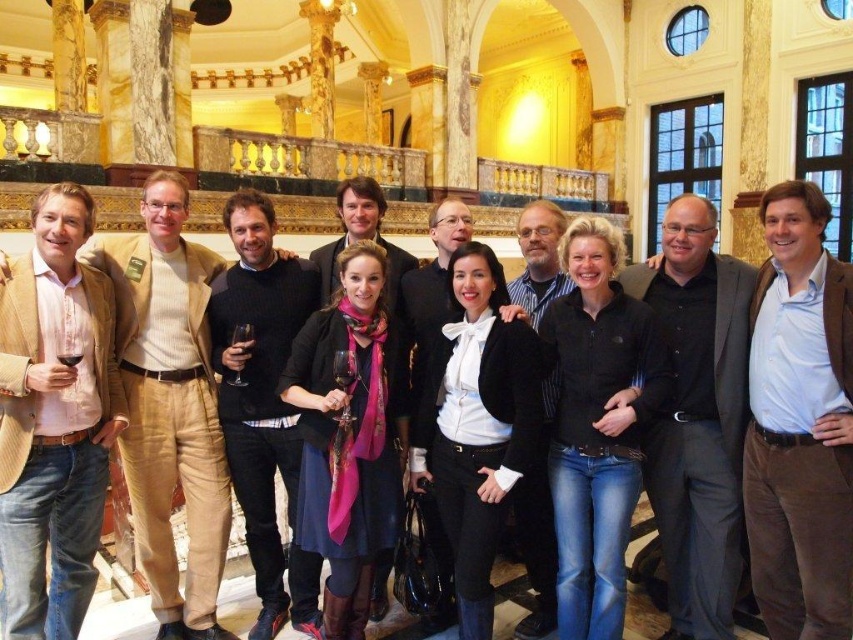
Question: Does matte beige blazer at left have a greater width compared to blue shirt at center?

Choices:
 (A) yes
 (B) no

Answer: (A)

Question: Is matte beige blazer at left behind black fleece jacket at center?

Choices:
 (A) yes
 (B) no

Answer: (B)

Question: Does matte beige blazer at left appear on the left side of blue shirt at center?

Choices:
 (A) yes
 (B) no

Answer: (A)

Question: Which object is the closest to the black matte blazer at center?

Choices:
 (A) blue shirt at center
 (B) black sweater at center

Answer: (B)

Question: Which object is closer to the camera taking this photo?

Choices:
 (A) matte beige blazer at left
 (B) blue shirt at center
 (C) black sweater at center

Answer: (A)

Question: Which point is closer to the camera?

Choices:
 (A) (526, 413)
 (B) (694, 211)

Answer: (A)